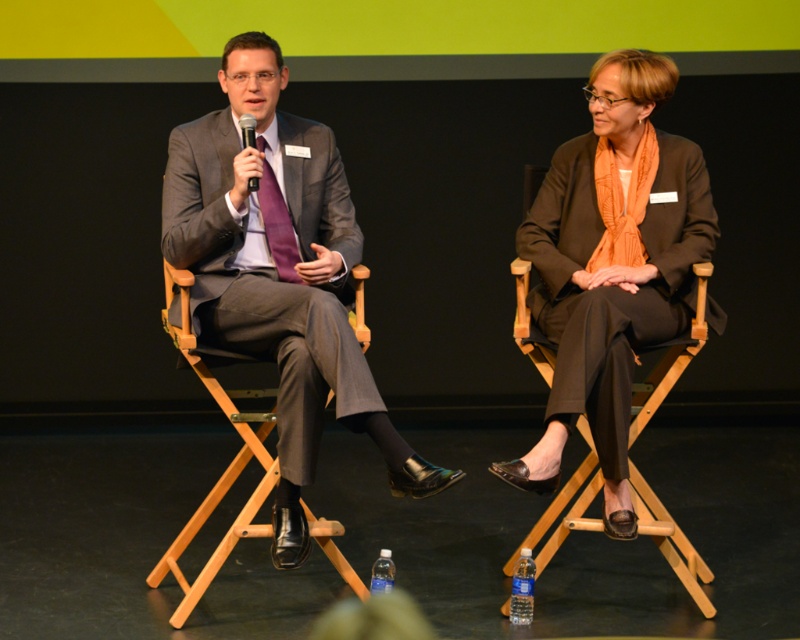
In the scene shown: You are standing at the camera position and want to throw a small ball to the point marked as point (x=668, y=324). What is the minimum distance you need to throw the ball to reach that point?

The minimum distance you need to throw the ball to reach point (x=668, y=324) is 3.20 meters, as that is the distance between the camera and the point.